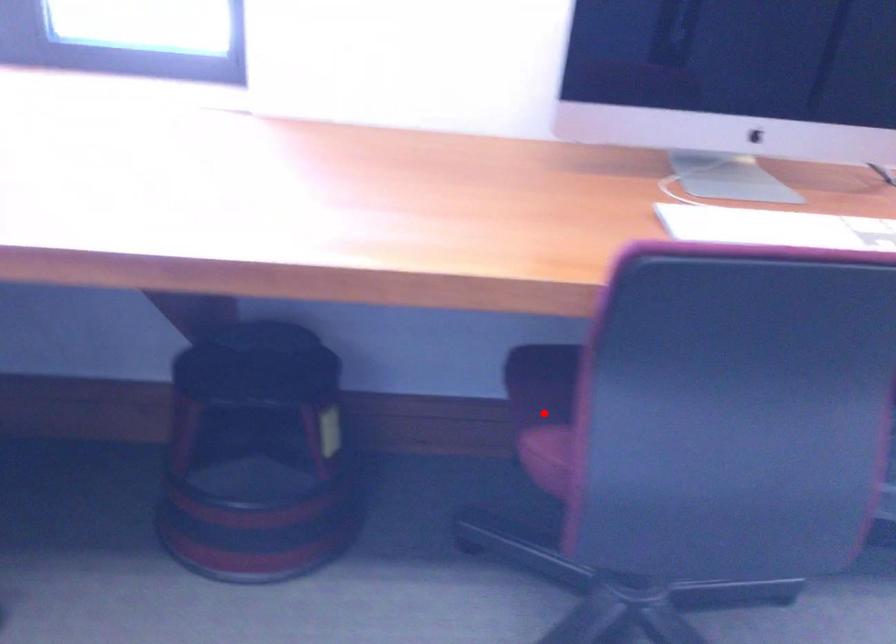
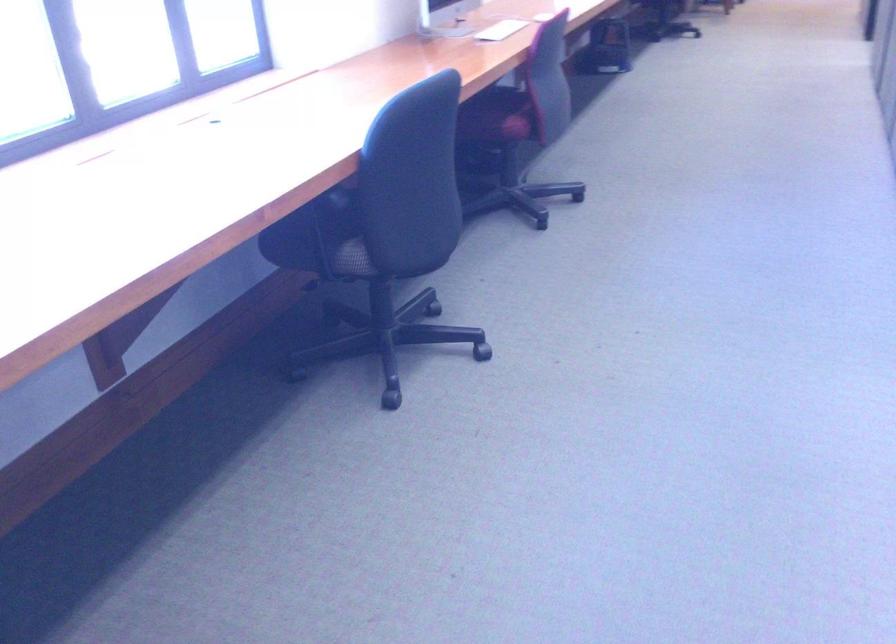
Question: I am providing you with two images of the same scene from different viewpoints. Image1 has a red point marked. In image2, the corresponding 3D location appears at what relative position? Reply with the corresponding letter.

Choices:
 (A) Closer
 (B) Farther

Answer: (B)